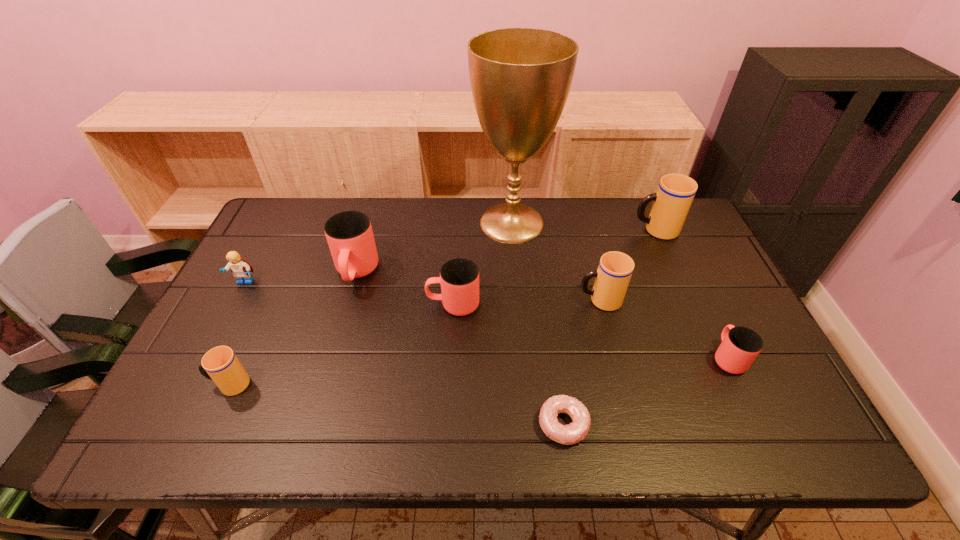
Identify the location of empty space between the rightmost beige cup and the tallest object. Image resolution: width=960 pixels, height=540 pixels. (584, 226).

Identify the location of empty location between the second cup from left to right and the biggest beige cup. (506, 252).

Find the location of `free spot between the rightmost pink cup and the nearest beige cup`. free spot between the rightmost pink cup and the nearest beige cup is located at coordinates (478, 371).

This screenshot has height=540, width=960. Identify the location of free spot between the rightmost beige cup and the leftmost object. (450, 256).

Find the location of a particular element. The image size is (960, 540). empty space between the tallest object and the second biggest pink cup is located at coordinates (482, 264).

Locate which object ranks third in proximity to the leftmost object. Please provide its 2D coordinates. Your answer should be formatted as a tuple, i.e. [(x, y)], where the tuple contains the x and y coordinates of a point satisfying the conditions above.

[(459, 278)]

I want to click on object that stands as the second closest to the farthest cup, so click(x=520, y=78).

Locate which cup ranks in proximity to the rightmost beige cup. Please provide its 2D coordinates. Your answer should be formatted as a tuple, i.e. [(x, y)], where the tuple contains the x and y coordinates of a point satisfying the conditions above.

[(615, 269)]

At what (x,y) coordinates should I click in order to perform the action: click on the third closest cup to the Lego. Please return your answer as a coordinate pair (x, y). This screenshot has width=960, height=540. Looking at the image, I should click on (459, 278).

Locate an element on the screen. This screenshot has width=960, height=540. beige cup that is the second closest to the tallest object is located at coordinates (671, 203).